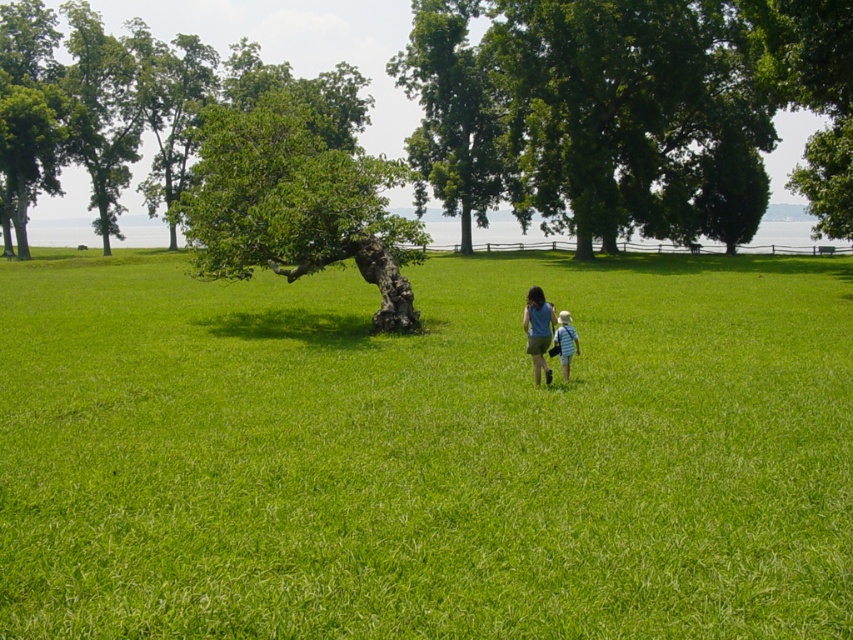
Question: Which point is farther to the camera?

Choices:
 (A) green rough bark tree at center
 (B) green grass at center
 (C) striped cotton shirt at center
 (D) green leafy tree at center

Answer: (D)

Question: Does green grass at center lie behind matte blue shirt at center?

Choices:
 (A) no
 (B) yes

Answer: (A)

Question: Estimate the real-world distances between objects in this image. Which object is closer to the green leafy tree at center?

Choices:
 (A) green rough bark tree at center
 (B) green grass at center
 (C) matte blue shirt at center

Answer: (A)

Question: Does green leafy tree at center appear on the left side of green rough bark tree at center?

Choices:
 (A) no
 (B) yes

Answer: (A)

Question: Does green grass at center appear under green rough bark tree at center?

Choices:
 (A) yes
 (B) no

Answer: (A)

Question: Which object appears farthest from the camera in this image?

Choices:
 (A) matte blue shirt at center
 (B) striped cotton shirt at center
 (C) green grass at center

Answer: (B)